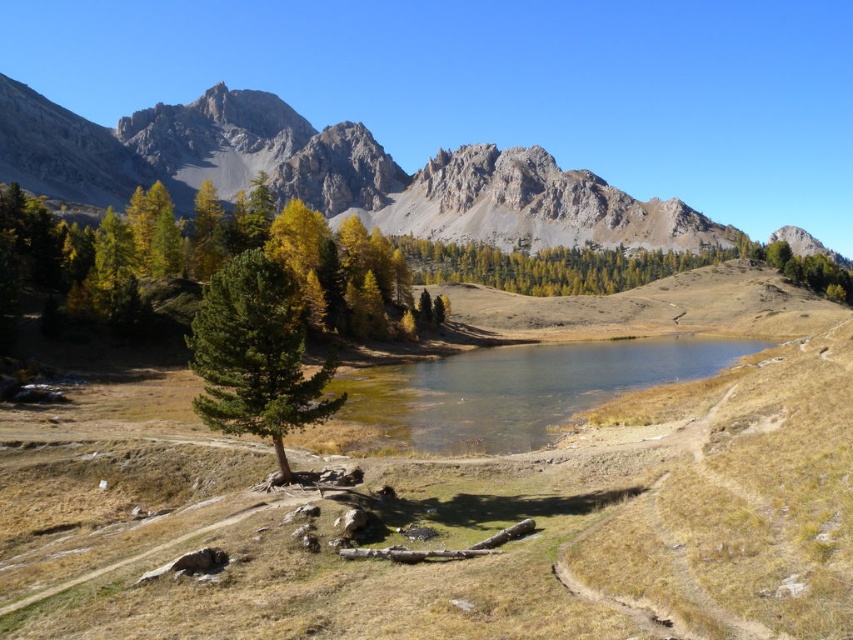
Is brown grassy hillside at center to the right of clear water at center from the viewer's perspective?

Indeed, brown grassy hillside at center is positioned on the right side of clear water at center.

How far apart are brown grassy hillside at center and clear water at center?

brown grassy hillside at center is 20.30 meters away from clear water at center.

Measure the distance between brown grassy hillside at center and camera.

31.02 meters

Where is `brown grassy hillside at center`? brown grassy hillside at center is located at coordinates (473, 500).

Is rugged stone mountain at upper left wider than green matte tree at center?

Yes.

Which is behind, point (192, 124) or point (236, 308)?

Point (192, 124)

This screenshot has width=853, height=640. What are the coordinates of `rugged stone mountain at upper left` in the screenshot? It's located at (331, 172).

Consider the image. Can you confirm if clear water at center is positioned above green matte tree at center?

Incorrect, clear water at center is not positioned above green matte tree at center.

Is clear water at center in front of green matte tree at center?

That is False.

Who is more forward, (393, 438) or (271, 392)?

Point (271, 392) is in front.

Identify the location of clear water at center. (518, 388).